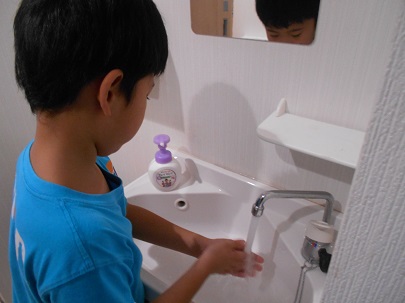
What are the coordinates of `tap` in the screenshot? It's located at (258, 204).